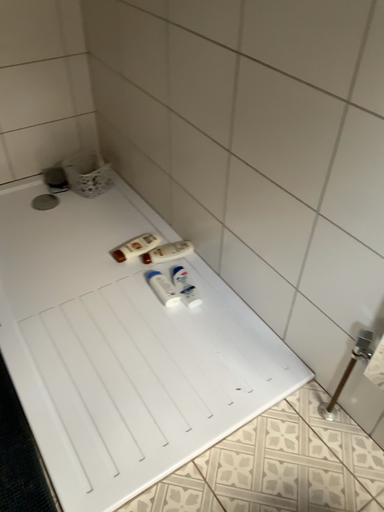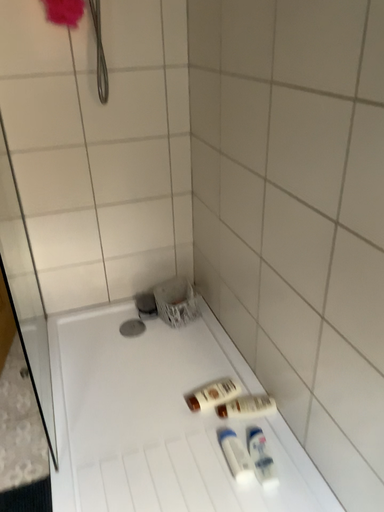
Question: Which way did the camera rotate in the video?

Choices:
 (A) rotated downward
 (B) rotated upward

Answer: (B)